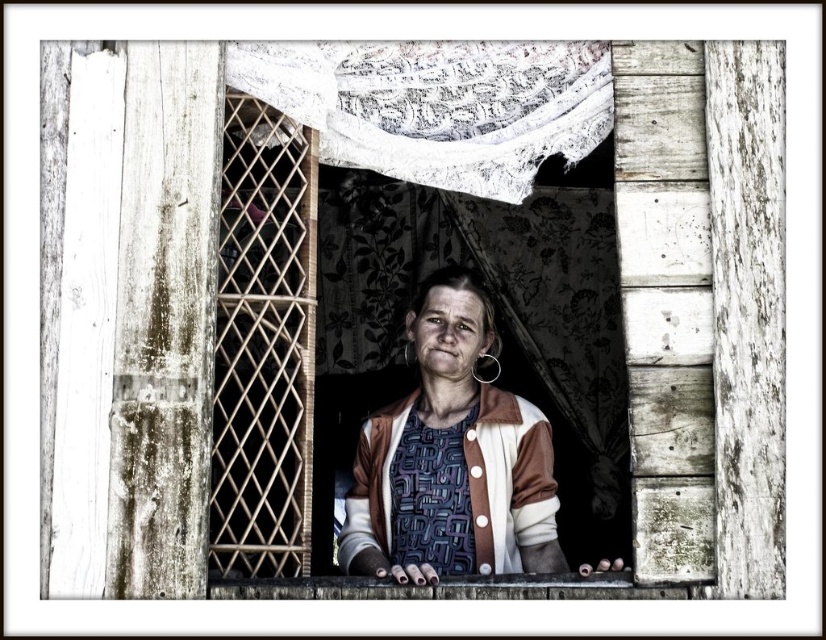
Question: Is brown textured sweater at center to the left of white lace curtain at upper center from the viewer's perspective?

Choices:
 (A) yes
 (B) no

Answer: (B)

Question: Is brown textured sweater at center to the right of white lace curtain at upper center from the viewer's perspective?

Choices:
 (A) no
 (B) yes

Answer: (B)

Question: Which point is farther to the camera?

Choices:
 (A) brown textured sweater at center
 (B) white lace curtain at upper center

Answer: (B)

Question: Which of the following is the farthest from the observer?

Choices:
 (A) white lace curtain at upper center
 (B) brown textured sweater at center

Answer: (A)

Question: Among these objects, which one is nearest to the camera?

Choices:
 (A) white lace curtain at upper center
 (B) brown textured sweater at center

Answer: (B)

Question: Can you confirm if brown textured sweater at center is bigger than white lace curtain at upper center?

Choices:
 (A) no
 (B) yes

Answer: (B)